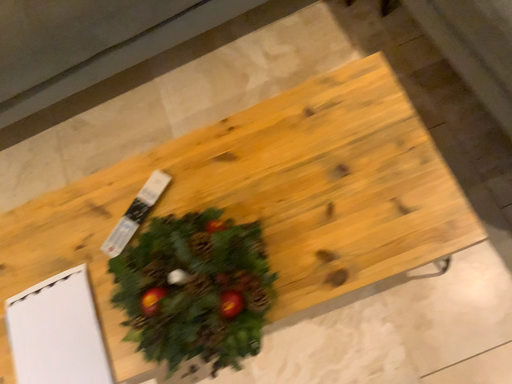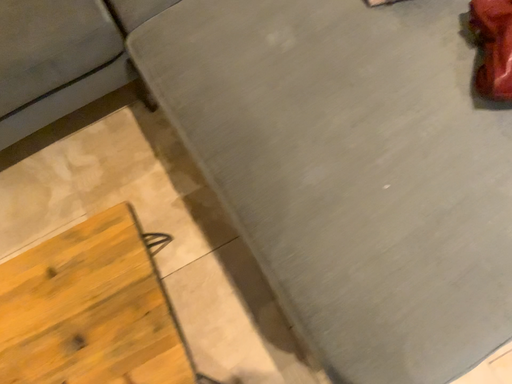
Question: Which way did the camera rotate in the video?

Choices:
 (A) rotated left
 (B) rotated right

Answer: (B)